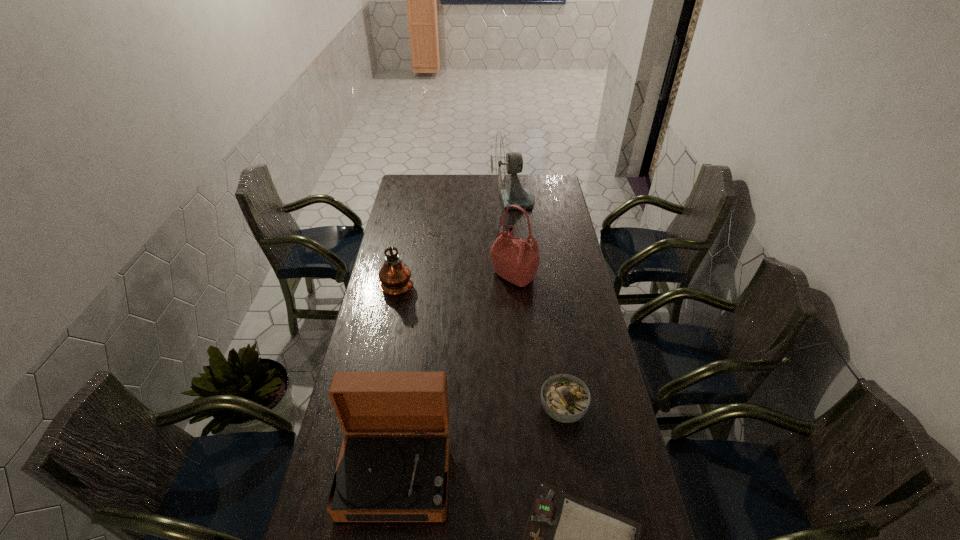
Locate an element on the screen. vacant space situated on the left of the soup bowl is located at coordinates [x=451, y=409].

At what (x,y) coordinates should I click in order to perform the action: click on object present at the far edge. Please return your answer as a coordinate pair (x, y). The width and height of the screenshot is (960, 540). Looking at the image, I should click on pos(503,162).

Find the location of a particular element. The image size is (960, 540). oil lamp situated at the left edge is located at coordinates (395, 276).

The height and width of the screenshot is (540, 960). Find the location of `phonograph record located at the left edge`. phonograph record located at the left edge is located at coordinates (379, 478).

This screenshot has width=960, height=540. In order to click on fan located in the right edge section of the desktop in this screenshot , I will do `click(503, 162)`.

Identify the location of soup bowl that is at the right edge. (565, 398).

Where is `object that is at the far right corner`? object that is at the far right corner is located at coordinates (503, 162).

Locate an element on the screen. vacant area at the far edge of the desktop is located at coordinates (478, 188).

Locate an element on the screen. Image resolution: width=960 pixels, height=540 pixels. free space at the left edge of the desktop is located at coordinates (414, 213).

You are a GUI agent. You are given a task and a screenshot of the screen. Output one action in this format:
    pyautogui.click(x=<x>, y=<y>)
    Task: Click on the free space at the right edge
    The height and width of the screenshot is (540, 960).
    Given the screenshot: What is the action you would take?
    pyautogui.click(x=562, y=261)